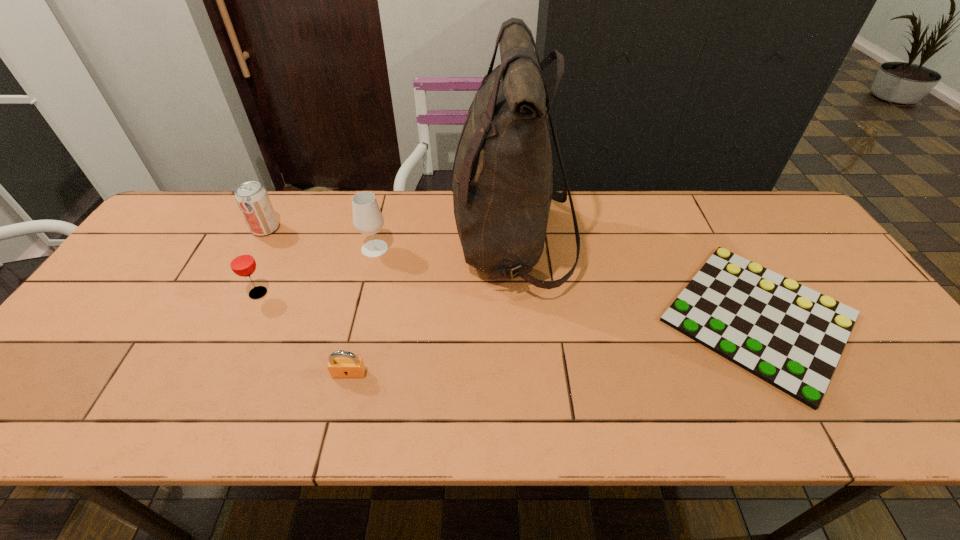
This screenshot has height=540, width=960. What are the coordinates of `free location that satisfies the following two spatial constraints: 1. on the open flap of the second object from right to left; 2. on the left side of the shortest object` in the screenshot? It's located at [517, 318].